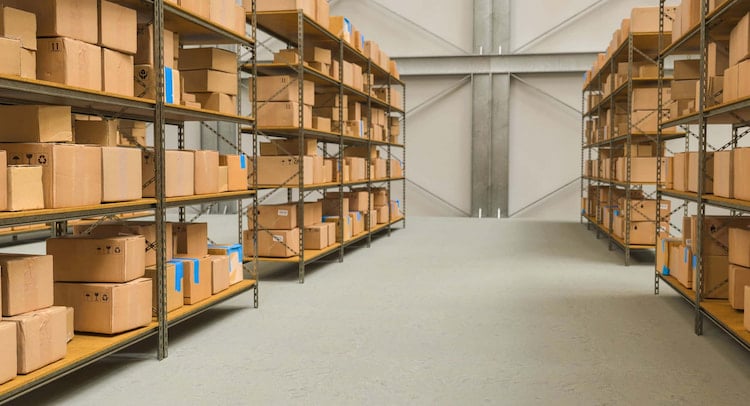
Image resolution: width=750 pixels, height=406 pixels. I want to click on angular sections on the wall in the background, so click(388, 34), click(438, 12), click(558, 16), click(584, 35), click(574, 87), click(543, 124), click(438, 134), click(422, 91), click(558, 199), click(420, 207).